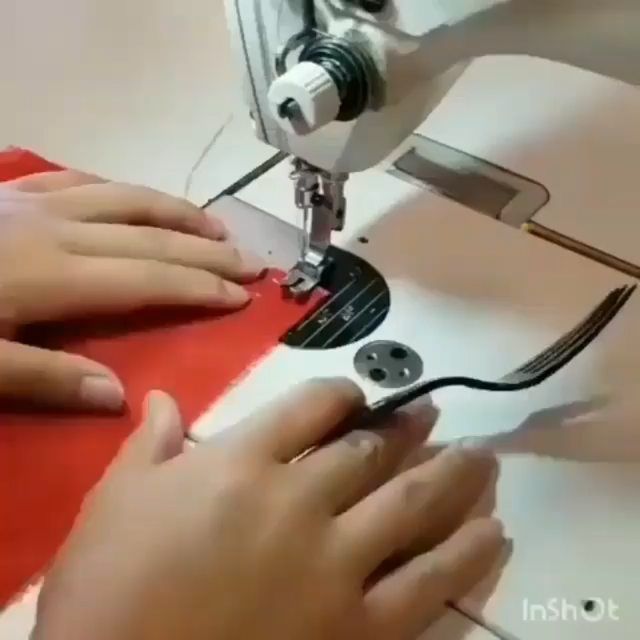
Where is `sewing machine presser foot`? This screenshot has width=640, height=640. sewing machine presser foot is located at coordinates (316, 249).